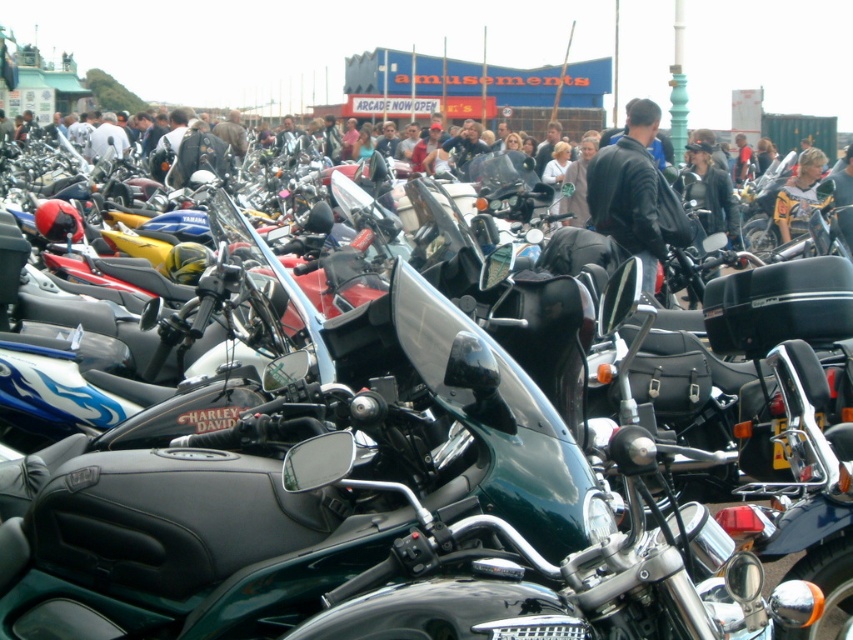
Who is more distant from viewer, (96, 230) or (805, 209)?

Positioned behind is point (805, 209).

Does point (28, 166) lie in front of point (801, 224)?

Yes.

What are the coordinates of `leather jacket at center` in the screenshot? It's located at (96, 193).

This screenshot has height=640, width=853. Describe the element at coordinates (96, 193) in the screenshot. I see `leather jacket at center` at that location.

Which of these two, leather jacket at center or black leather jacket at center, stands taller?

leather jacket at center is taller.

Does point (120, 253) come farther from viewer compared to point (628, 209)?

Yes, point (120, 253) is farther from viewer.

Where is `leather jacket at center`? This screenshot has height=640, width=853. leather jacket at center is located at coordinates (96, 193).

Who is more forward, (614, 209) or (799, 232)?

Point (614, 209) is in front.

Can you confirm if black leather jacket at center is taller than yellow leather jacket at center?

Yes.

This screenshot has width=853, height=640. What do you see at coordinates (635, 193) in the screenshot? I see `black leather jacket at center` at bounding box center [635, 193].

Find the location of a particular element. black leather jacket at center is located at coordinates (635, 193).